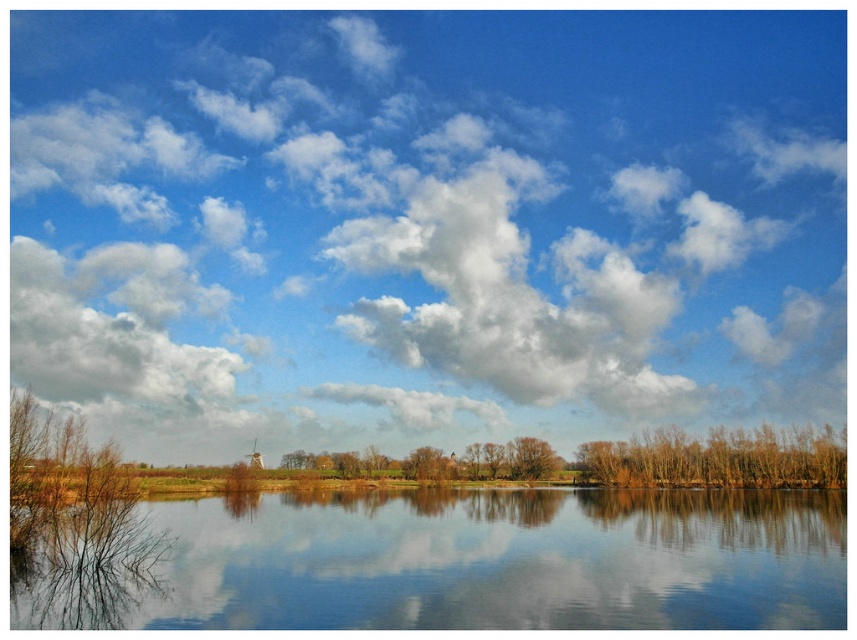
You are standing at the edge of the water and looking out. Which object, the white fluffy cloud at upper center or the brown matte tree at center, is higher in the sky?

The white fluffy cloud at upper center is higher in the sky than the brown matte tree at center because it is positioned above it.

You are standing at the edge of the water and want to take a photo that includes both the white fluffy cloud at upper left and the brown matte tree at center. Given that your camera has a maximum zoom range of 100 meters, will you be able to capture both objects in a single frame without moving?

The white fluffy cloud at upper left is 94.31 meters away from the brown matte tree at center. Since the distance between them is within the camera maximum zoom range of 100 meters, you can capture both in a single frame without moving.